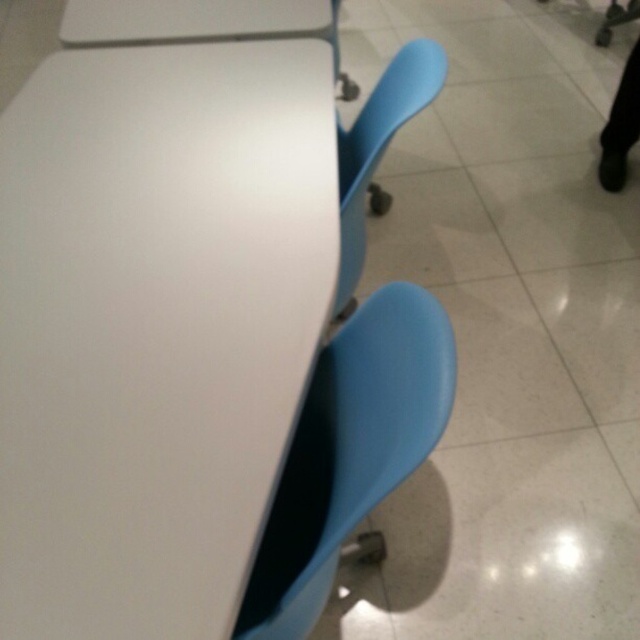
Question: Considering the real-world distances, which object is closest to the matte blue swivel chair at lower right?

Choices:
 (A) matte plastic swivel chair at center
 (B) white glossy table at center

Answer: (A)

Question: Which of the following is the closest to the observer?

Choices:
 (A) (364, 141)
 (B) (321, 518)

Answer: (B)

Question: Is white glossy table at center to the left of matte plastic swivel chair at center from the viewer's perspective?

Choices:
 (A) yes
 (B) no

Answer: (A)

Question: Does white glossy table at center appear over matte blue swivel chair at lower right?

Choices:
 (A) no
 (B) yes

Answer: (B)

Question: Which of these objects is positioned farthest from the matte plastic swivel chair at center?

Choices:
 (A) white glossy table at center
 (B) matte blue swivel chair at lower right

Answer: (A)

Question: Can you confirm if matte blue swivel chair at lower right is smaller than matte plastic swivel chair at center?

Choices:
 (A) yes
 (B) no

Answer: (A)